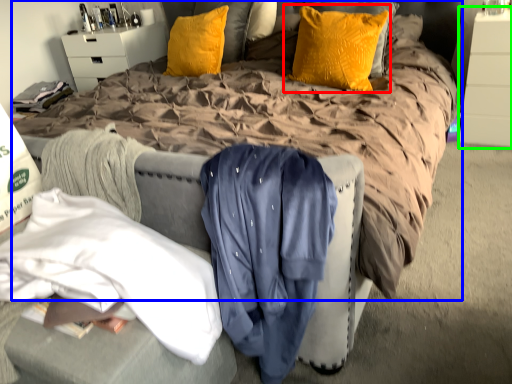
Question: Which is nearer to the pillow (highlighted by a red box)? bed (highlighted by a blue box) or dresser (highlighted by a green box).

Choices:
 (A) bed
 (B) dresser

Answer: (A)